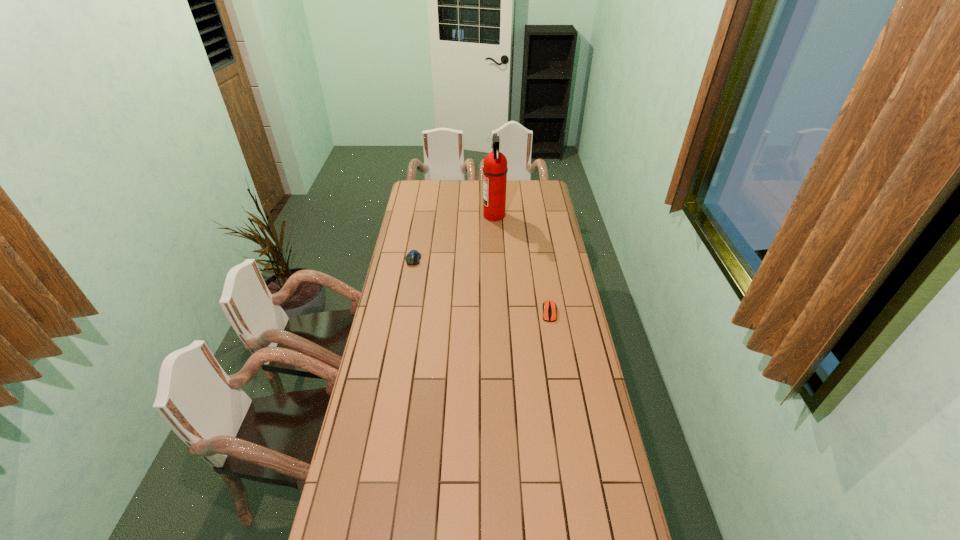
You are a GUI agent. You are given a task and a screenshot of the screen. Output one action in this format:
    pyautogui.click(x=<x>, y=<y>)
    Task: Click on the free space located 0.070m on the button side of the leftmost object
    
    Given the screenshot: What is the action you would take?
    pyautogui.click(x=410, y=276)

The height and width of the screenshot is (540, 960). What are the coordinates of `object situated at the left edge` in the screenshot? It's located at (413, 257).

The height and width of the screenshot is (540, 960). I want to click on object located in the right edge section of the desktop, so click(x=549, y=307).

Locate an element on the screen. The height and width of the screenshot is (540, 960). vacant region at the far edge is located at coordinates (460, 184).

Where is `vacant space at the left edge of the desktop`? Image resolution: width=960 pixels, height=540 pixels. vacant space at the left edge of the desktop is located at coordinates (352, 440).

Identify the location of free space at the right edge of the desktop. (565, 362).

In order to click on vacant space at the far right corner of the desktop in this screenshot , I will do `click(542, 199)`.

The image size is (960, 540). I want to click on vacant area between the second farthest object and the nearer computer mouse, so click(481, 286).

Locate an element on the screen. Image resolution: width=960 pixels, height=540 pixels. free space between the left computer mouse and the fire extinguisher is located at coordinates (453, 237).

This screenshot has width=960, height=540. Identify the location of free spot between the second object from left to right and the nearest object. (521, 264).